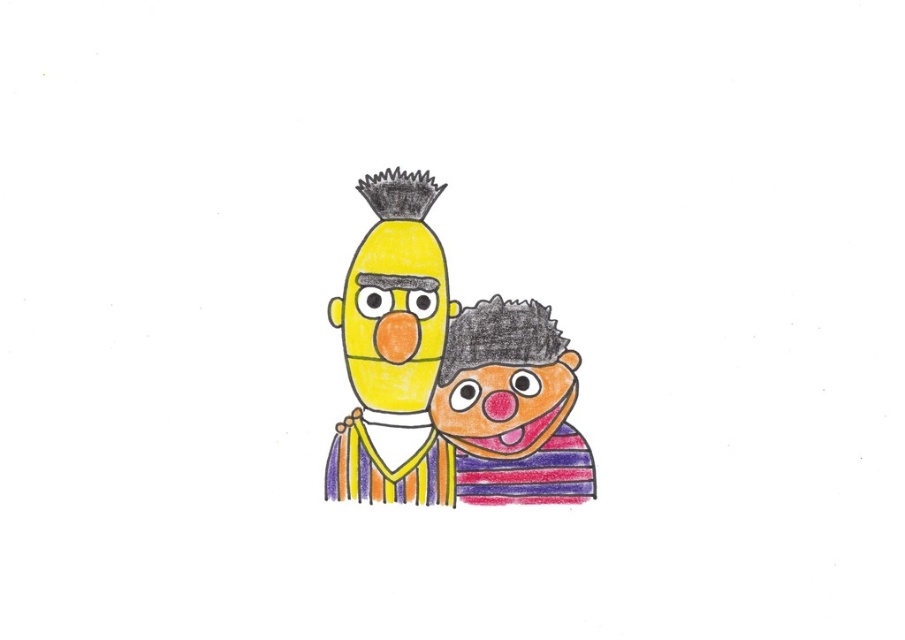
Does matte yellow head at center have a smaller size compared to orange matte nose at center?

Actually, matte yellow head at center might be larger than orange matte nose at center.

Does point (383, 316) come closer to viewer compared to point (386, 336)?

Yes, it is in front of point (386, 336).

Who is more forward, (387, 404) or (383, 326)?

Point (387, 404) is in front.

Locate an element on the screen. matte yellow head at center is located at coordinates (393, 346).

Can you confirm if matte yellow head at center is smaller than yellow matte face at center?

Actually, matte yellow head at center might be larger than yellow matte face at center.

Does point (441, 273) lie behind point (337, 324)?

Yes, point (441, 273) is farther from viewer.

I want to click on matte yellow head at center, so click(393, 346).

Can you confirm if smooth striped sweater at right is positioned to the left of orange matte nose at center?

No, smooth striped sweater at right is not to the left of orange matte nose at center.

What do you see at coordinates (505, 404) in the screenshot?
I see `smooth striped sweater at right` at bounding box center [505, 404].

Based on the photo, measure the distance between point (520, 444) and camera.

Point (520, 444) is 1.26 meters from camera.

Identify the location of smooth striped sweater at right. (505, 404).